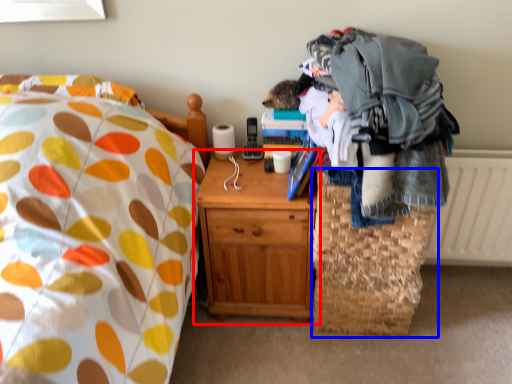
Question: Which point is further to the camera, nightstand (highlighted by a red box) or basket (highlighted by a blue box)?

Choices:
 (A) nightstand
 (B) basket

Answer: (B)